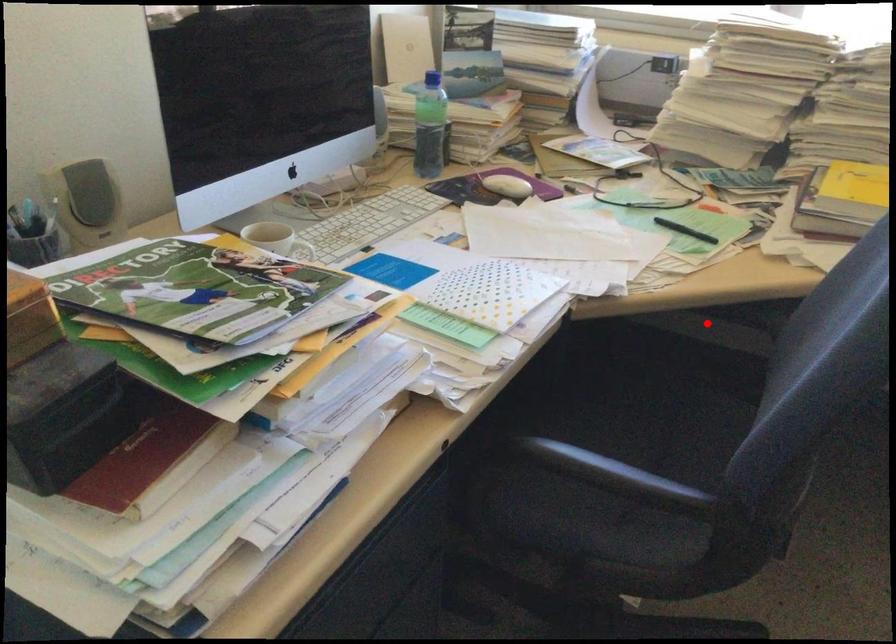
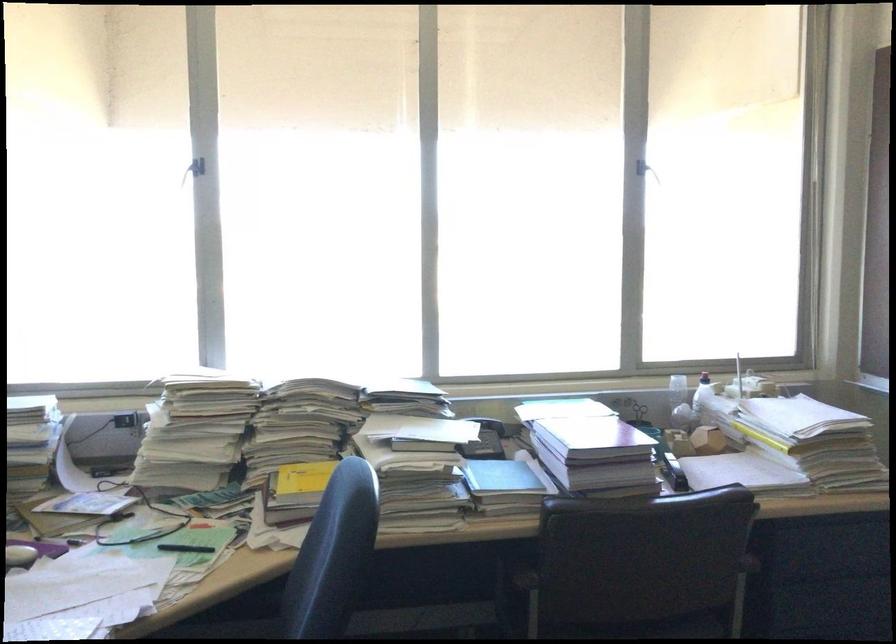
In the second image, find the point that corresponds to the highlighted location in the first image.

(225, 629)